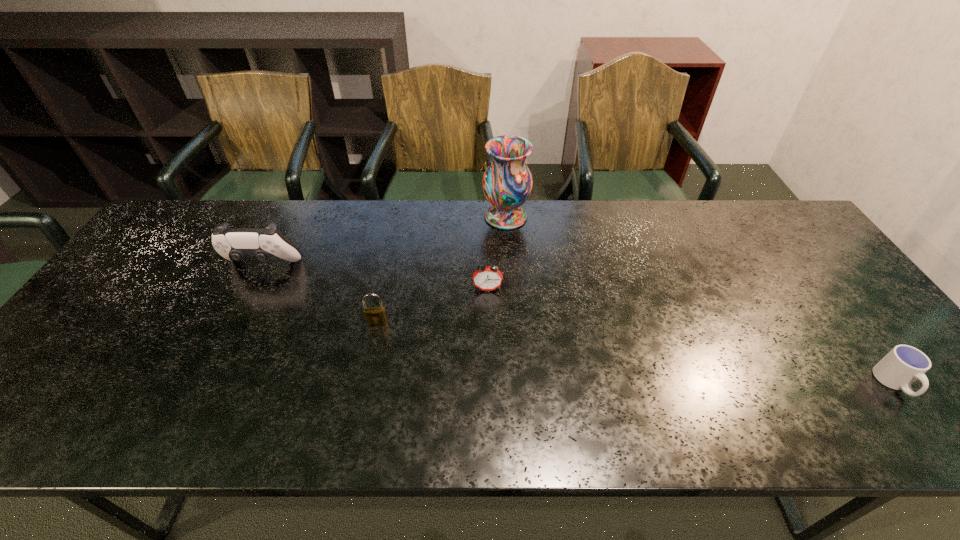
What are the coordinates of `free space located 0.400m on the front-facing side of the leftmost object` in the screenshot? It's located at (191, 406).

Find the location of a particular element. vacant space located on the back of the fourth farthest object is located at coordinates (392, 254).

This screenshot has height=540, width=960. I want to click on vacant space situated 0.140m on the clock face of the alarm clock, so click(489, 334).

Locate an element on the screen. object situated at the far edge is located at coordinates (507, 182).

The image size is (960, 540). Identify the location of object that is at the near edge. (904, 364).

Where is `object at the right edge`? The height and width of the screenshot is (540, 960). object at the right edge is located at coordinates (904, 364).

Find the location of a particular element. object that is positioned at the near right corner is located at coordinates (904, 364).

Locate an element on the screen. The height and width of the screenshot is (540, 960). free space at the far edge of the desktop is located at coordinates (702, 227).

In the image, there is a desktop. Where is `vacant space at the near edge`? vacant space at the near edge is located at coordinates (867, 437).

The height and width of the screenshot is (540, 960). I want to click on free location at the left edge, so click(x=114, y=349).